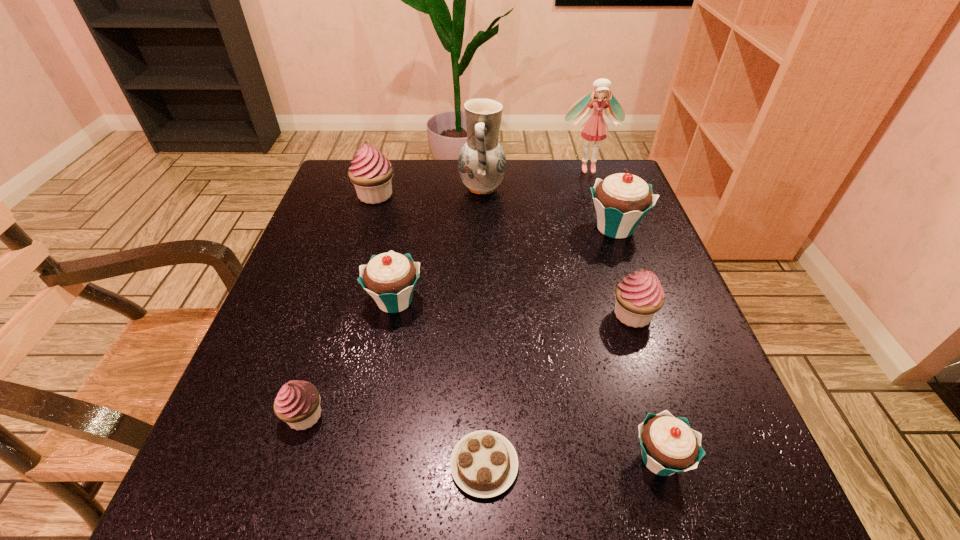
You are a GUI agent. You are given a task and a screenshot of the screen. Output one action in this format:
    pyautogui.click(x=<x>, y=<y>)
    Task: Click on the pink cupcake that is the third nearest to the pink doll
    This screenshot has height=540, width=960.
    Given the screenshot: What is the action you would take?
    297,403

Where is `pink cupcake that is the third closest to the second nearest teal cupcake`? The image size is (960, 540). pink cupcake that is the third closest to the second nearest teal cupcake is located at coordinates (640, 295).

Locate an element on the screen. The width and height of the screenshot is (960, 540). the second closest teal cupcake to the smallest teal cupcake is located at coordinates (622, 200).

Identify the location of the third closest teal cupcake to the chocolate cake. [x=622, y=200].

Find the location of a particular element. Image resolution: width=960 pixels, height=540 pixels. free space that satisfies the following two spatial constraints: 1. on either side of the pottery; 2. on the back side of the smallest teal cupcake is located at coordinates (484, 459).

Identify the location of free location that satisfies the following two spatial constraints: 1. on the front side of the leftmost teal cupcake; 2. on the right side of the smallest teal cupcake. This screenshot has height=540, width=960. (365, 459).

This screenshot has width=960, height=540. I want to click on vacant region that satisfies the following two spatial constraints: 1. on the front side of the farthest pink cupcake; 2. on the right side of the second nearest teal cupcake, so click(344, 301).